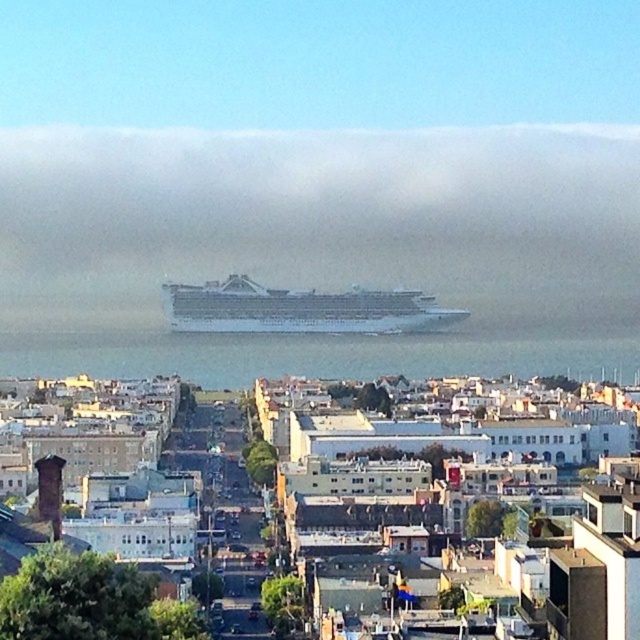
Is point (560, 240) closer to viewer compared to point (228, 310)?

No, (560, 240) is further to viewer.

Is white matte cruise ship at center taller than white glossy cruise ship at center?

Yes.

You are a GUI agent. You are given a task and a screenshot of the screen. Output one action in this format:
    pyautogui.click(x=<x>, y=<y>)
    Task: Click on the white matte cruise ship at center
    
    Given the screenshot: What is the action you would take?
    pyautogui.click(x=321, y=216)